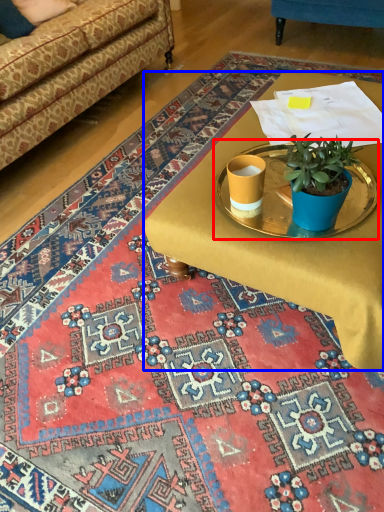
Question: Which point is further to the camera, round table (highlighted by a red box) or desk (highlighted by a blue box)?

Choices:
 (A) round table
 (B) desk

Answer: (A)